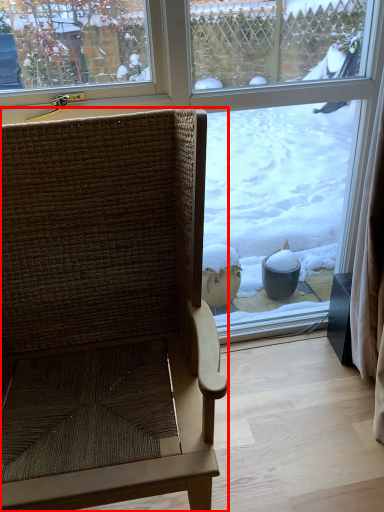
Question: From the image's perspective, what is the correct spatial positioning of chair (annotated by the red box) in reference to window?

Choices:
 (A) below
 (B) above

Answer: (A)